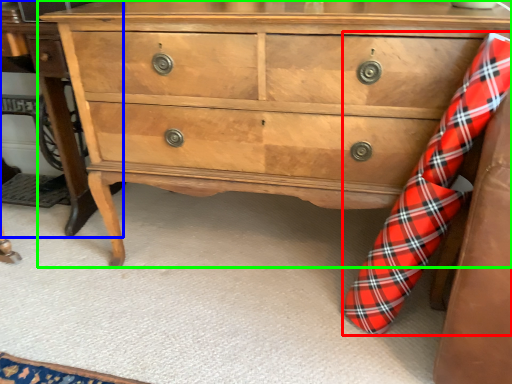
Question: Which is farther away from sock (highlighted by a red box)? table (highlighted by a blue box) or chest of drawers (highlighted by a green box)?

Choices:
 (A) table
 (B) chest of drawers

Answer: (A)